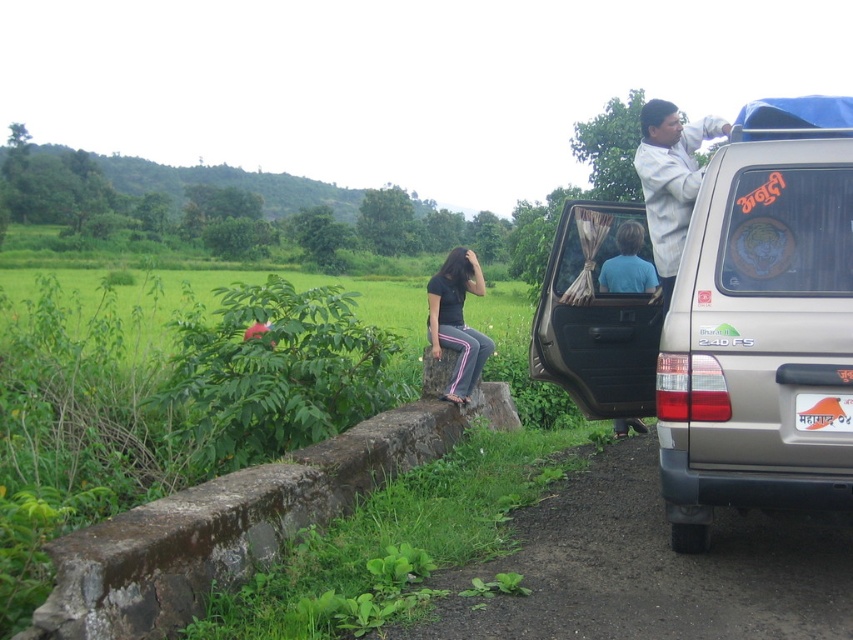
Is silver metallic jeep at right to the left of white cotton shirt at upper right from the viewer's perspective?

Yes, silver metallic jeep at right is to the left of white cotton shirt at upper right.

Which is in front, point (756, 211) or point (654, 262)?

Point (756, 211) is in front.

Find the location of a particular element. This screenshot has width=853, height=640. silver metallic jeep at right is located at coordinates (730, 317).

Between silver metallic jeep at right and matte black shirt at center, which one appears on the right side from the viewer's perspective?

silver metallic jeep at right

Who is more forward, (662, 312) or (433, 289)?

Point (662, 312) is more forward.

Locate an element on the screen. The image size is (853, 640). silver metallic jeep at right is located at coordinates (730, 317).

Is point (657, 116) less distant than point (476, 381)?

Yes.

Is white cotton shirt at upper right in front of matte black shirt at center?

Yes, white cotton shirt at upper right is in front of matte black shirt at center.

Is point (675, 204) farther from camera compared to point (476, 289)?

That is False.

This screenshot has width=853, height=640. Find the location of `white cotton shirt at upper right`. white cotton shirt at upper right is located at coordinates (670, 180).